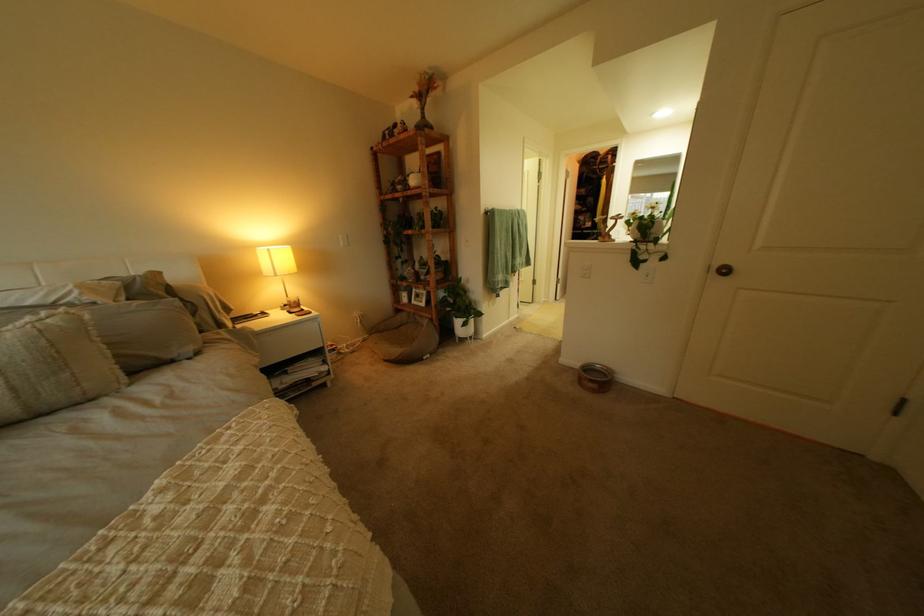
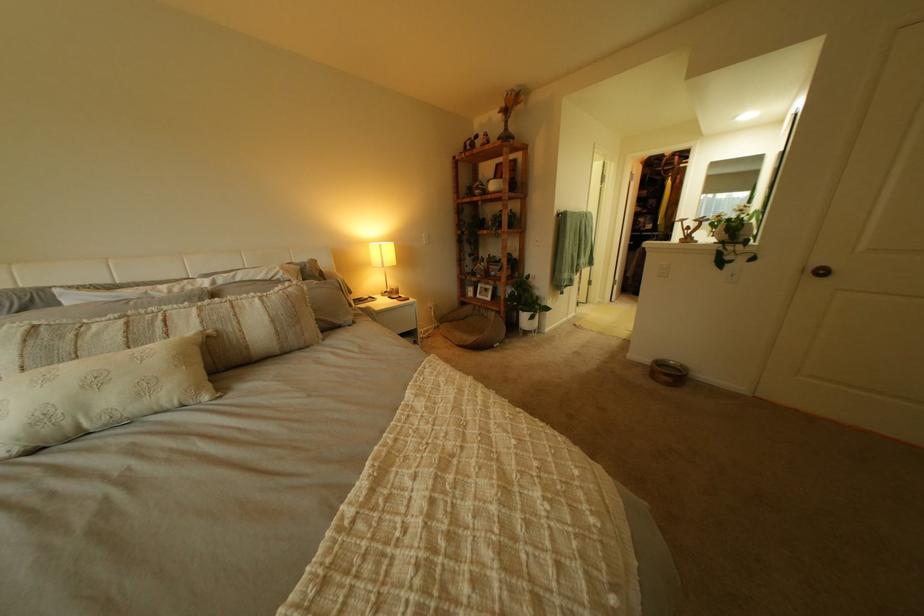
Where in the second image is the point corresponding to point (593, 367) from the first image?

(663, 362)